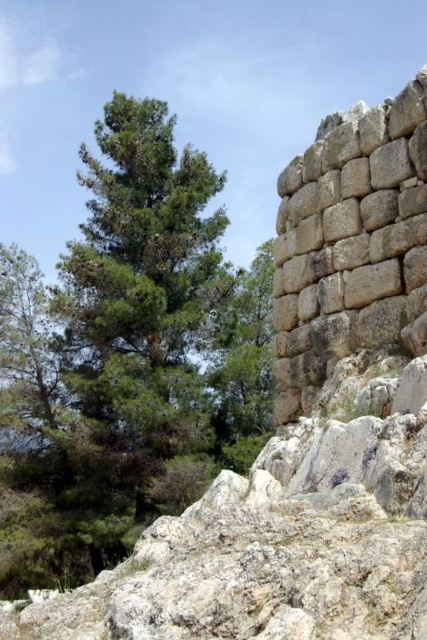
Question: Can you confirm if green leafy tree at upper left is positioned to the left of natural stone wall at right?

Choices:
 (A) yes
 (B) no

Answer: (A)

Question: In this image, where is green leafy tree at upper left located relative to natural stone wall at right?

Choices:
 (A) below
 (B) above

Answer: (A)

Question: Is green leafy tree at upper left wider than natural stone wall at right?

Choices:
 (A) yes
 (B) no

Answer: (A)

Question: Which point is farther from the camera taking this photo?

Choices:
 (A) (72, 284)
 (B) (310, 205)

Answer: (A)

Question: Among these points, which one is farthest from the camera?

Choices:
 (A) (386, 348)
 (B) (55, 296)

Answer: (B)